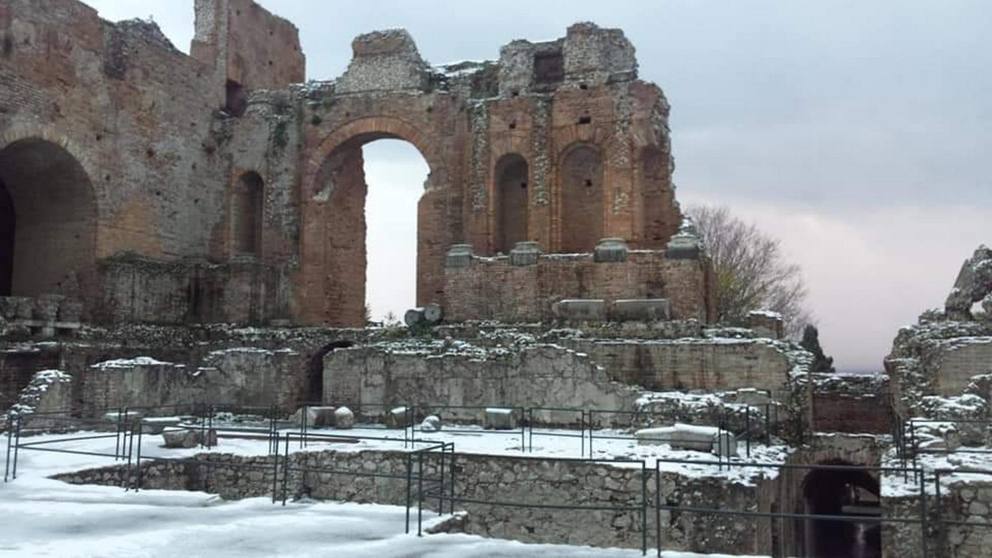
I want to click on archway opening, so click(x=381, y=124).